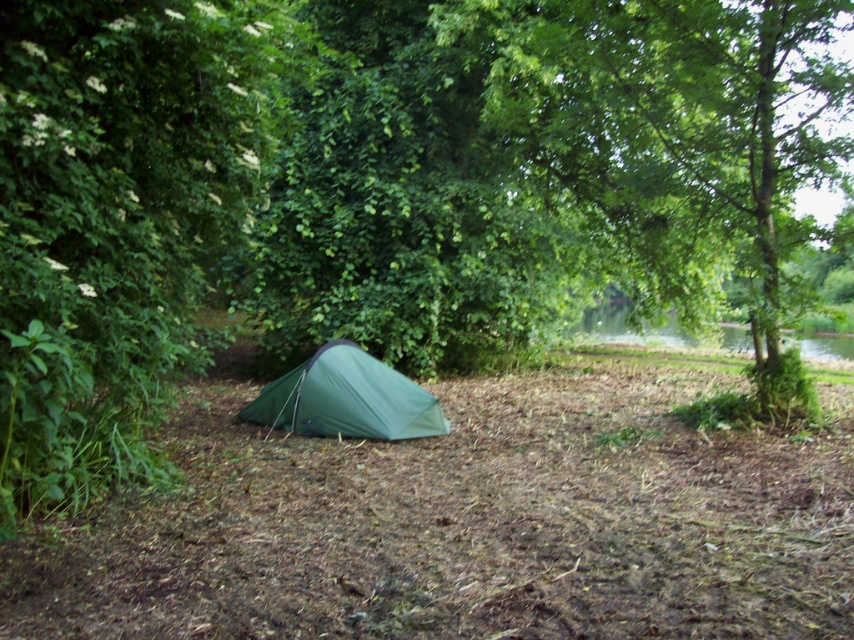
You are standing at the center of the campsite and want to reach the green leafy tree marked by point (x=680, y=138). Which direction should you move to get there?

The point (x=680, y=138) marks the green leafy tree at center, so you are already at the center where the tree is located. You don not need to move in any direction.

You are setting up a campsite and need to place a small table between the green leafy tree at center and the green fabric tent at center. Which side of the table should face the tree?

The green leafy tree at center is to the right of the green fabric tent at center, so the right side of the table should face the tree.